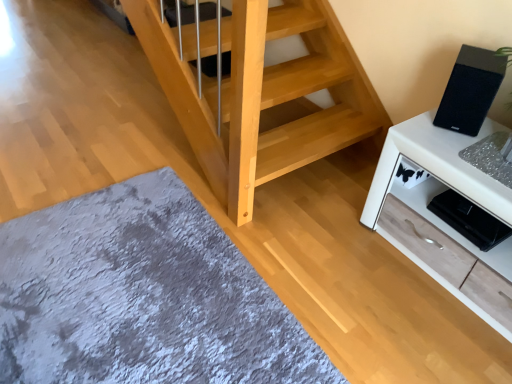
Question: Relative to gray plush rug at lower left, is white wood cabinet at right in front or behind?

Choices:
 (A) behind
 (B) front

Answer: (A)

Question: Choose the correct answer: Is white wood cabinet at right inside gray plush rug at lower left or outside it?

Choices:
 (A) outside
 (B) inside

Answer: (A)

Question: Based on their relative distances, which object is nearer to the white wood cabinet at right?

Choices:
 (A) black matte speaker at upper right
 (B) gray plush rug at lower left

Answer: (A)

Question: Which of these objects is positioned closest to the white wood cabinet at right?

Choices:
 (A) gray plush rug at lower left
 (B) black matte speaker at upper right

Answer: (B)